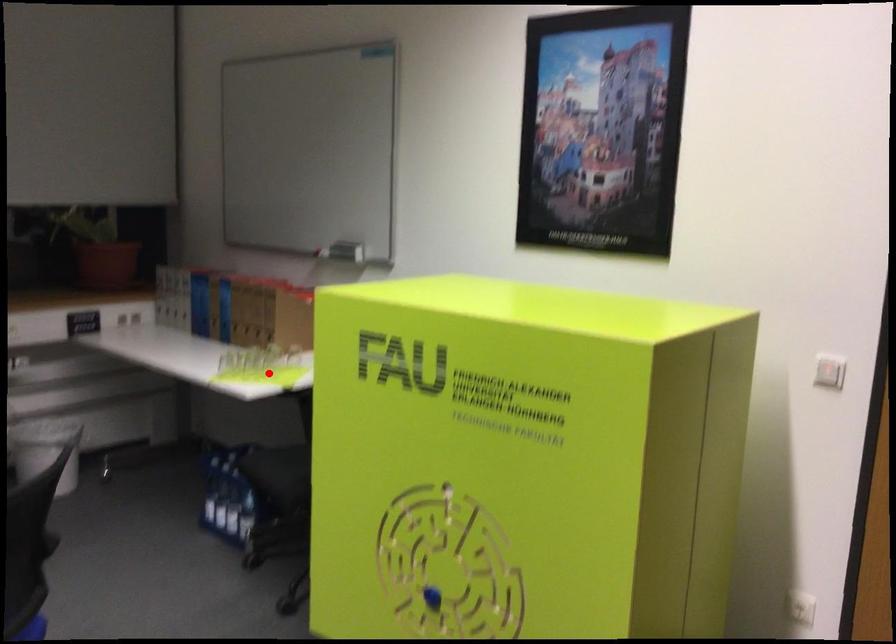
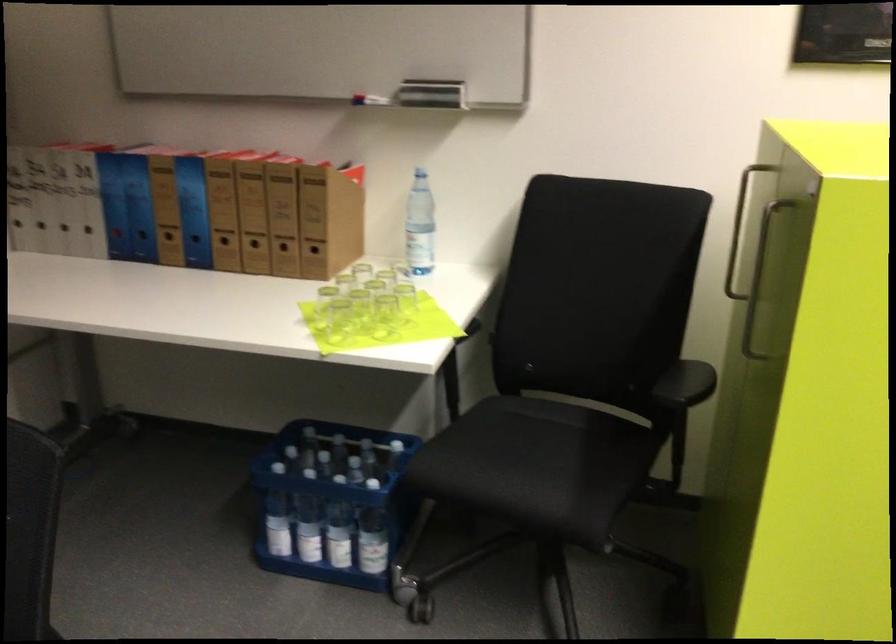
Question: I am providing you with two images of the same scene from different viewpoints. Given a red point in image1, look at the same physical point in image2. Is it:

Choices:
 (A) Closer to the viewpoint
 (B) Farther from the viewpoint

Answer: (A)